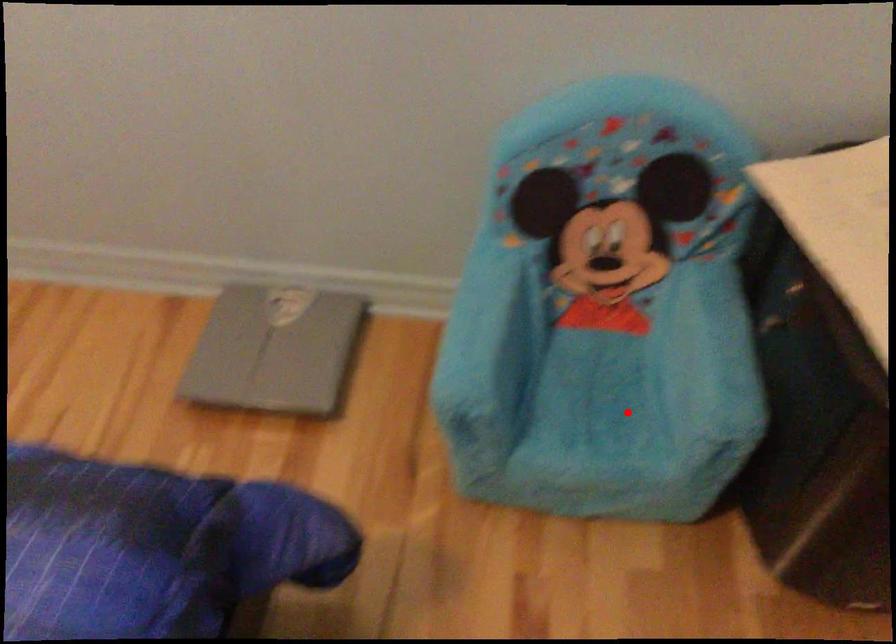
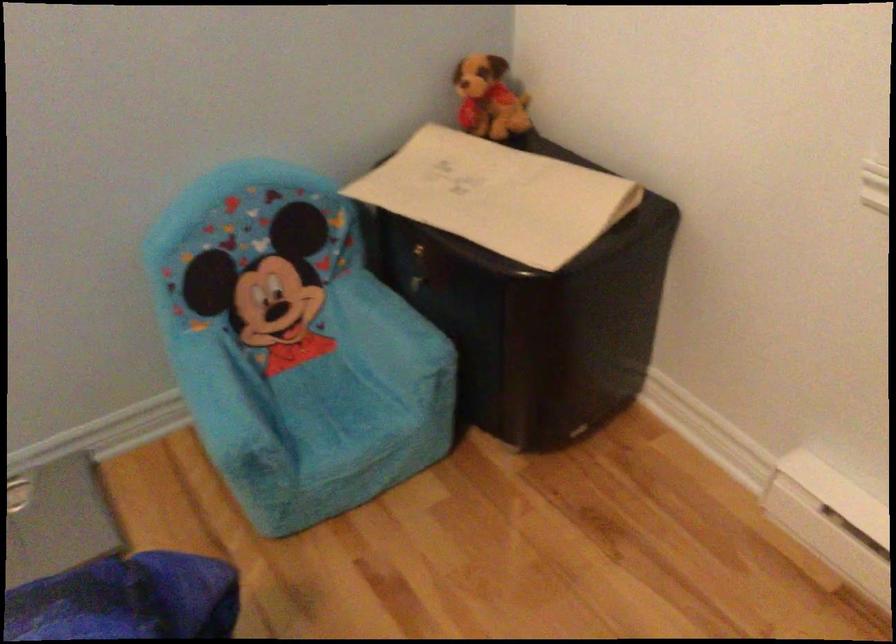
Question: I am providing you with two images of the same scene from different viewpoints. Given a red point in image1, look at the same physical point in image2. Is it:

Choices:
 (A) Closer to the viewpoint
 (B) Farther from the viewpoint

Answer: (B)